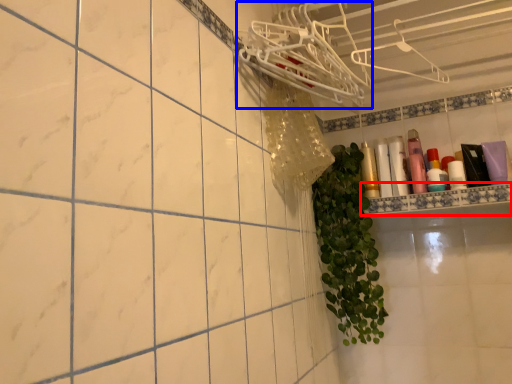
Question: Which point is further to the camera, ledge (highlighted by a red box) or hanger (highlighted by a blue box)?

Choices:
 (A) ledge
 (B) hanger

Answer: (A)